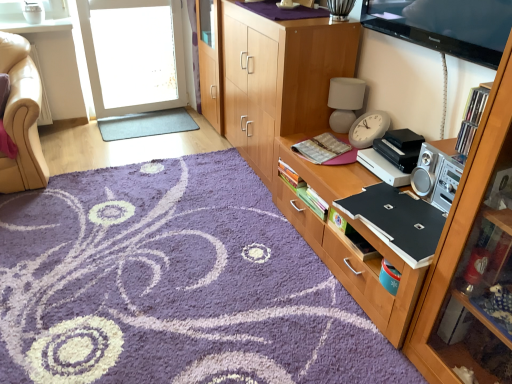
Question: Considering the relative sizes of black matte laptop at right and gray rubber mat at center, the 1th plain from the back, in the image provided, is black matte laptop at right shorter than gray rubber mat at center, the 1th plain from the back,?

Choices:
 (A) no
 (B) yes

Answer: (A)

Question: Would you consider black matte laptop at right to be distant from gray rubber mat at center, placed as the second plain when sorted from bottom to top?

Choices:
 (A) yes
 (B) no

Answer: (A)

Question: From the image's perspective, would you say black matte laptop at right is shown under gray rubber mat at center, placed as the second plain when sorted from bottom to top?

Choices:
 (A) yes
 (B) no

Answer: (A)

Question: Are black matte laptop at right and gray rubber mat at center, the 1th plain in the top-to-bottom sequence, making contact?

Choices:
 (A) yes
 (B) no

Answer: (B)

Question: From a real-world perspective, is black matte laptop at right beneath gray rubber mat at center, the 1th plain in the top-to-bottom sequence?

Choices:
 (A) no
 (B) yes

Answer: (A)

Question: Does black matte laptop at right appear on the right side of gray rubber mat at center, the 1th plain from the back?

Choices:
 (A) yes
 (B) no

Answer: (A)

Question: Considering the relative sizes of wooden cabinet at right, the third cabinetry positioned from the back, and clear plastic cds at upper right in the image provided, is wooden cabinet at right, the third cabinetry positioned from the back, smaller than clear plastic cds at upper right?

Choices:
 (A) yes
 (B) no

Answer: (B)

Question: Is wooden cabinet at right, arranged as the 1th cabinetry when viewed from the front, located outside clear plastic cds at upper right?

Choices:
 (A) yes
 (B) no

Answer: (A)

Question: Can you confirm if wooden cabinet at right, arranged as the 1th cabinetry when viewed from the front, is wider than clear plastic cds at upper right?

Choices:
 (A) no
 (B) yes

Answer: (B)

Question: Is wooden cabinet at right, the third cabinetry positioned from the back, far from clear plastic cds at upper right?

Choices:
 (A) yes
 (B) no

Answer: (B)

Question: Can you confirm if wooden cabinet at right, arranged as the 1th cabinetry when viewed from the front, is positioned to the right of clear plastic cds at upper right?

Choices:
 (A) yes
 (B) no

Answer: (B)

Question: From the image's perspective, is wooden cabinet at right, the third cabinetry positioned from the back, over clear plastic cds at upper right?

Choices:
 (A) no
 (B) yes

Answer: (A)

Question: Is clear plastic cds at upper right to the right of purple shaggy rug at center, positioned as the 1th plain in bottom-to-top order, from the viewer's perspective?

Choices:
 (A) no
 (B) yes

Answer: (B)